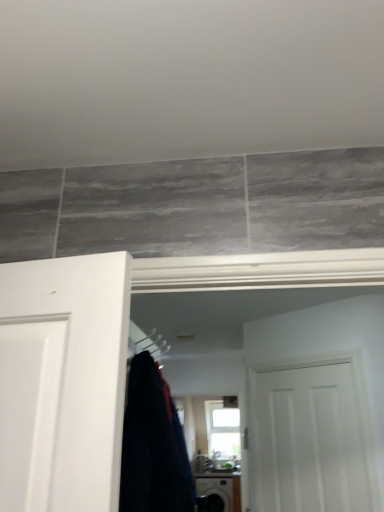
Question: Based on their positions, is dark blue fabric at center located to the left or right of silver metallic hanger at center?

Choices:
 (A) right
 (B) left

Answer: (A)

Question: Looking at their shapes, would you say dark blue fabric at center is wider or thinner than silver metallic hanger at center?

Choices:
 (A) wide
 (B) thin

Answer: (A)

Question: Estimate the real-world distances between objects in this image. Which object is farther from the white matte door at center?

Choices:
 (A) silver metallic hanger at center
 (B) dark blue fabric at center
 (C) black glossy washing machine at lower center
 (D) clear glass window at center

Answer: (C)

Question: Which object is the closest to the clear glass window at center?

Choices:
 (A) white matte door at center
 (B) dark blue fabric at center
 (C) black glossy washing machine at lower center
 (D) silver metallic hanger at center

Answer: (C)